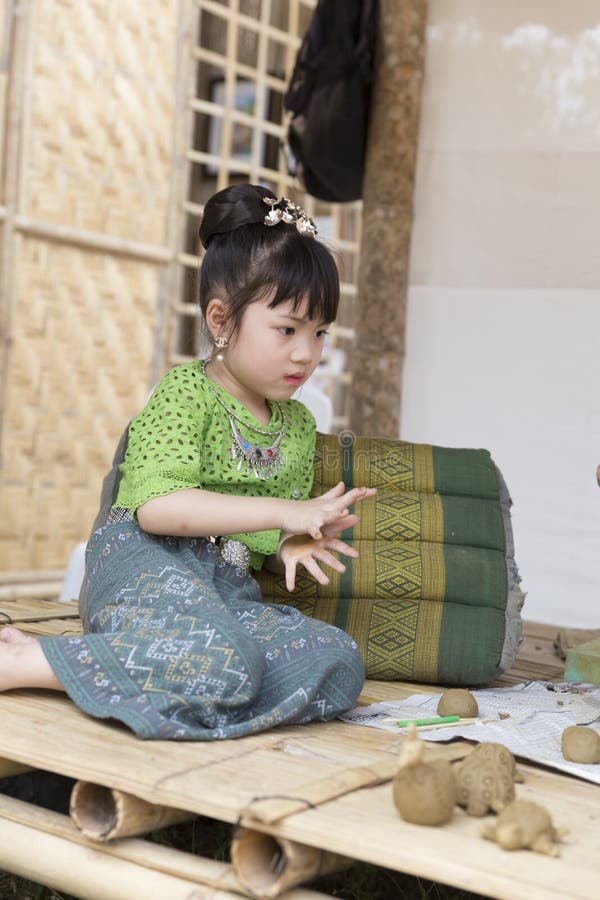
Where is `toys`? This screenshot has height=900, width=600. toys is located at coordinates (433, 794), (478, 772), (525, 834).